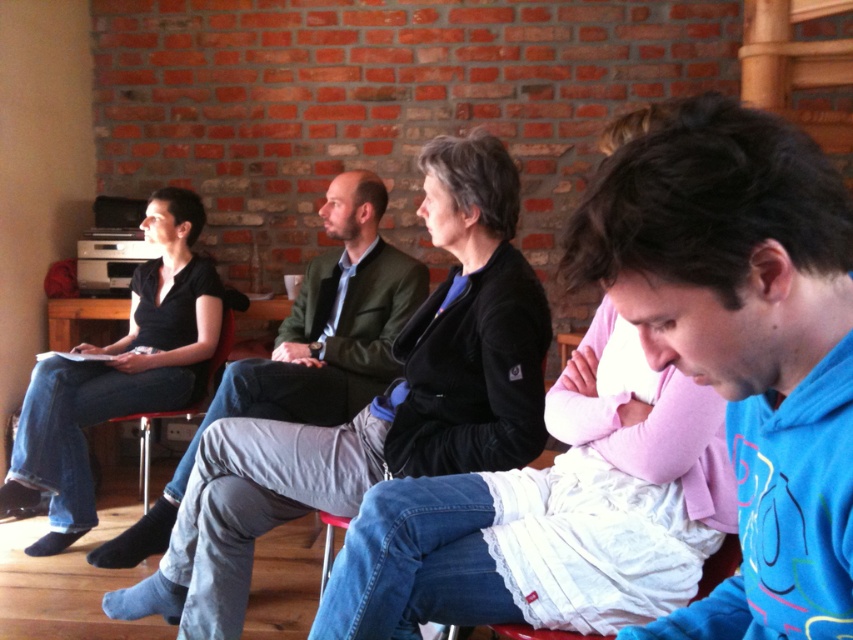
Between point (688, 291) and point (149, 429), which one is positioned behind?

Positioned behind is point (149, 429).

Which is more to the left, blue fleece jacket at center or red plastic chair at left?

red plastic chair at left

Does point (764, 316) lie behind point (210, 365)?

No, it is not.

Identify the location of blue fleece jacket at center. pyautogui.click(x=743, y=340).

Is blue fleece jacket at center above matte green jacket at center?

Incorrect, blue fleece jacket at center is not positioned above matte green jacket at center.

Who is higher up, blue fleece jacket at center or matte green jacket at center?

matte green jacket at center is above.

What are the coordinates of `blue fleece jacket at center` in the screenshot? It's located at (743, 340).

Identify the location of blue fleece jacket at center. (743, 340).

How distant is matte black shirt at upper left from red plastic chair at left?

matte black shirt at upper left and red plastic chair at left are 10.61 inches apart.

Find the location of `matte black shirt at upper left`. matte black shirt at upper left is located at coordinates (119, 372).